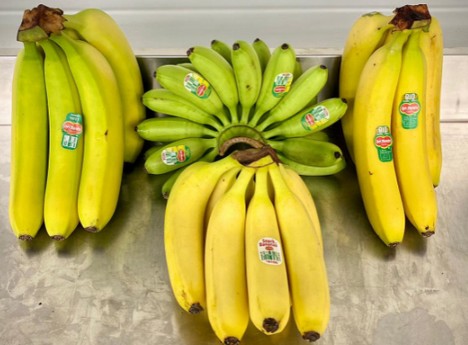
At what (x,y) coordinates should I click in order to perform the action: click on sticker. Please return your answer as a coordinate pair (x, y). Image resolution: width=468 pixels, height=345 pixels. Looking at the image, I should click on (70, 136), (207, 88), (182, 161), (277, 86), (312, 124), (269, 252), (413, 115), (379, 144).